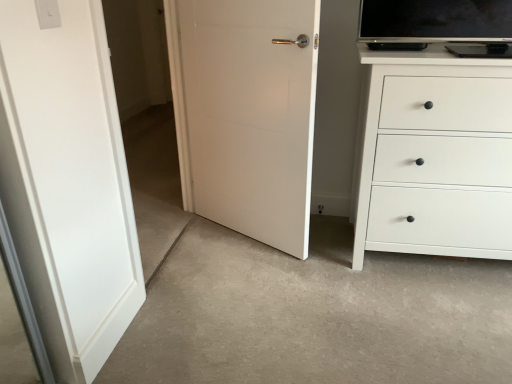
Question: Is white plastic light switch at upper left positioned with its back to white matte door at center?

Choices:
 (A) yes
 (B) no

Answer: (B)

Question: From a real-world perspective, is white plastic light switch at upper left positioned under white matte door at center based on gravity?

Choices:
 (A) yes
 (B) no

Answer: (B)

Question: Could white matte door at center be considered to be inside white plastic light switch at upper left?

Choices:
 (A) no
 (B) yes

Answer: (A)

Question: From a real-world perspective, is white plastic light switch at upper left physically above white matte door at center?

Choices:
 (A) no
 (B) yes

Answer: (B)

Question: Does white plastic light switch at upper left have a greater height compared to white matte door at center?

Choices:
 (A) no
 (B) yes

Answer: (A)

Question: From the image's perspective, is white plastic light switch at upper left below white matte door at center?

Choices:
 (A) no
 (B) yes

Answer: (A)

Question: From the image's perspective, would you say white matte chest of drawers at right is shown under white matte door at center?

Choices:
 (A) yes
 (B) no

Answer: (A)

Question: Is white matte chest of drawers at right closer to the viewer compared to white matte door at center?

Choices:
 (A) no
 (B) yes

Answer: (B)

Question: Is white matte chest of drawers at right outside of white matte door at center?

Choices:
 (A) yes
 (B) no

Answer: (A)

Question: Are white matte chest of drawers at right and white matte door at center making contact?

Choices:
 (A) no
 (B) yes

Answer: (A)

Question: Is white matte chest of drawers at right looking in the opposite direction of white matte door at center?

Choices:
 (A) no
 (B) yes

Answer: (A)

Question: Can you confirm if white matte chest of drawers at right is positioned to the right of white matte door at center?

Choices:
 (A) no
 (B) yes

Answer: (B)

Question: Does white plastic light switch at upper left turn towards transparent glass door at left?

Choices:
 (A) no
 (B) yes

Answer: (A)